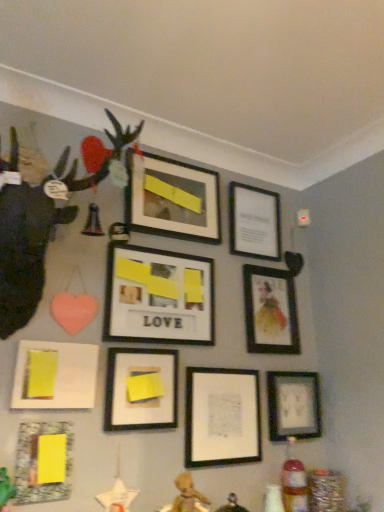
Question: Looking at the image, does matte black picture frame at upper right, placed as the 2th picture frame when sorted from right to left, seem bigger or smaller compared to matte glass picture frame at lower left, the first picture frame when ordered from left to right?

Choices:
 (A) small
 (B) big

Answer: (B)

Question: From a real-world perspective, is matte black picture frame at upper right, placed as the 2th picture frame when sorted from right to left, physically located above or below matte glass picture frame at lower left, the first picture frame when ordered from left to right?

Choices:
 (A) below
 (B) above

Answer: (B)

Question: Which is nearer to the matte black picture frame at upper center, the fifth picture frame viewed from the left?

Choices:
 (A) matte black picture frame at center, arranged as the 6th picture frame when viewed from the left
 (B) matte glass picture frame at lower left, which ranks as the 9th picture frame in right-to-left order
 (C) matte black picture frame at lower right, the ninth picture frame when ordered from left to right
 (D) matte black figurine at left
 (E) matte black picture frame at upper right, placed as the 2th picture frame when sorted from right to left

Answer: (D)

Question: Estimate the real-world distances between objects in this image. Which object is closer to the matte glass picture frame at lower left, which ranks as the 9th picture frame in right-to-left order?

Choices:
 (A) matte paper picture frame at center, which ranks as the 6th picture frame in right-to-left order
 (B) matte black picture frame at center, which is counted as the 7th picture frame, starting from the right
 (C) matte black picture frame at upper right, placed as the 2th picture frame when sorted from right to left
 (D) matte black figurine at left
 (E) matte black picture frame at upper center, the 5th picture frame in the right-to-left sequence

Answer: (B)